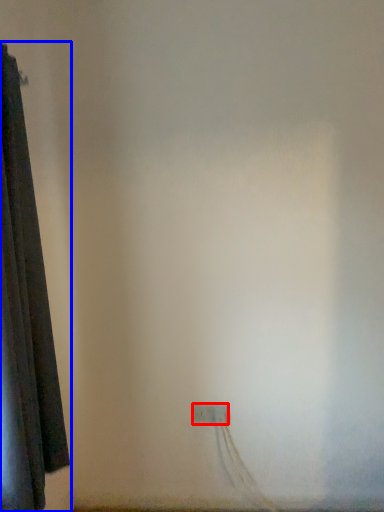
Question: Which object is further to the camera taking this photo, power plugs and sockets (highlighted by a red box) or curtain (highlighted by a blue box)?

Choices:
 (A) power plugs and sockets
 (B) curtain

Answer: (A)